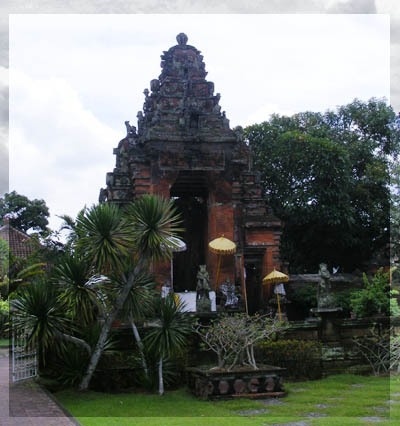
This screenshot has height=426, width=400. Identify the location of statue. (325, 280), (204, 277).